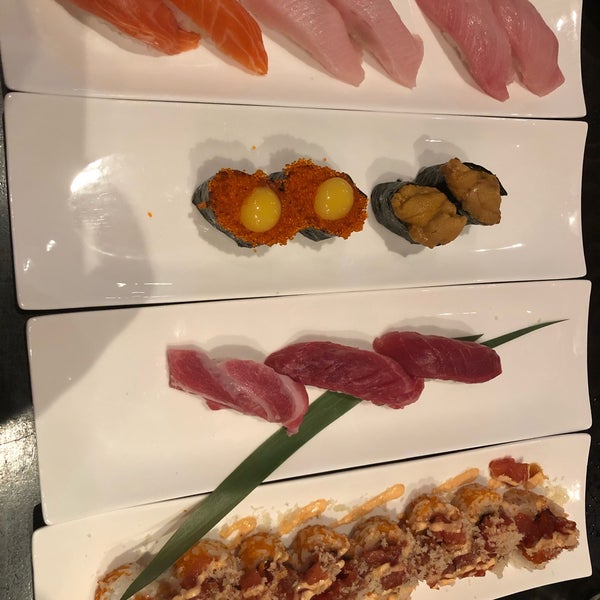
The image size is (600, 600). What are the coordinates of `plate` in the screenshot? It's located at (58, 423).